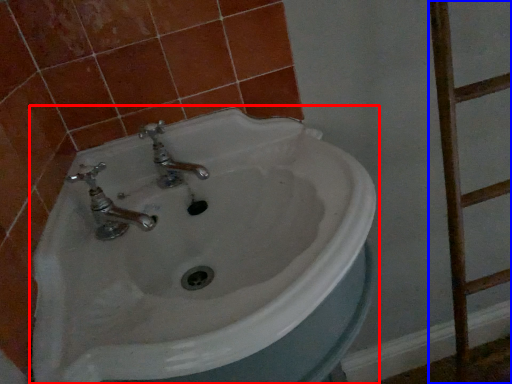
Question: Among these objects, which one is farthest to the camera, sink (highlighted by a red box) or ladder (highlighted by a blue box)?

Choices:
 (A) sink
 (B) ladder

Answer: (B)